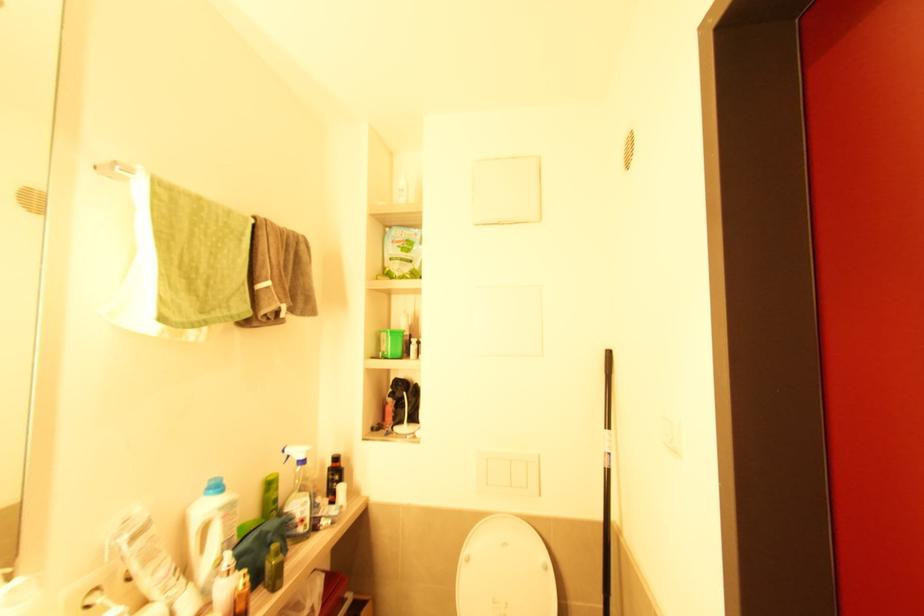
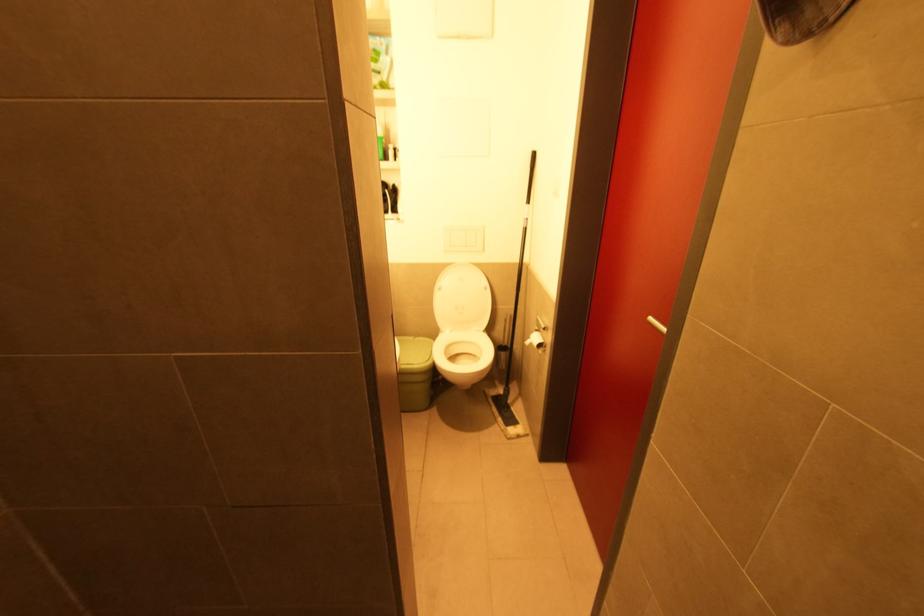
Question: How did the camera likely rotate?

Choices:
 (A) Left
 (B) Right
 (C) Up
 (D) Down

Answer: (D)